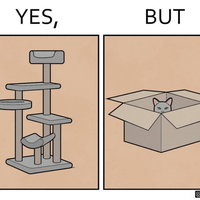
The height and width of the screenshot is (200, 200). I want to click on cardboard box, so click(x=160, y=136).